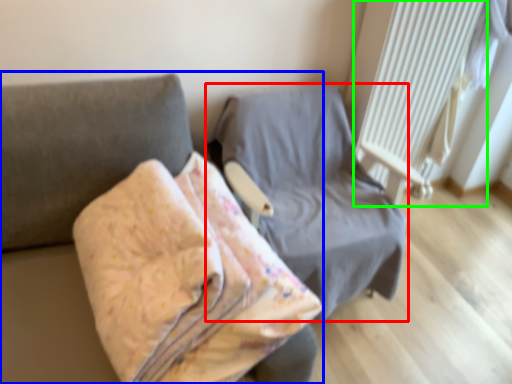
Question: Based on their relative distances, which object is nearer to furniture (highlighted by a red box)? Choose from furniture (highlighted by a blue box) and radiator (highlighted by a green box).

Choices:
 (A) furniture
 (B) radiator

Answer: (B)